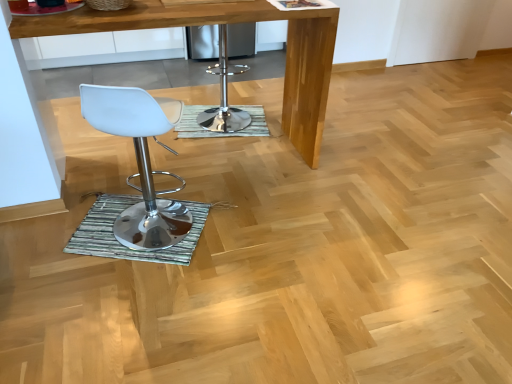
At what (x,y) coordinates should I click in order to perform the action: click on vacant area that lies in front of wooden table at center. Please return your answer as a coordinate pair (x, y). Looking at the image, I should click on (198, 276).